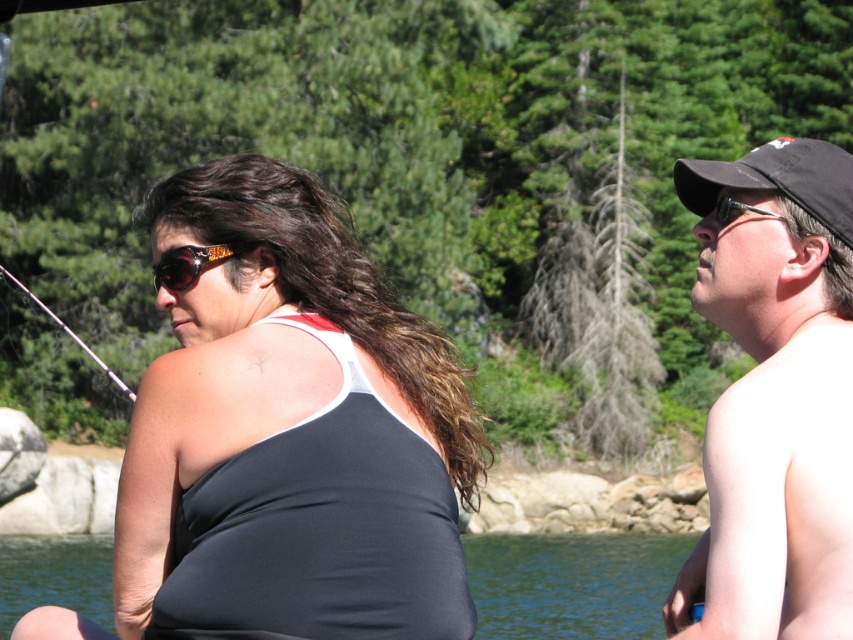
Question: Which point is closer to the camera taking this photo?

Choices:
 (A) (283, 202)
 (B) (844, 216)
 (C) (538, 589)

Answer: (B)

Question: Can you confirm if transparent water at lower center is positioned to the right of black fabric baseball cap at right?

Choices:
 (A) yes
 (B) no

Answer: (B)

Question: Which object is positioned farthest from the transparent water at lower center?

Choices:
 (A) black fabric baseball cap at right
 (B) black cap at right
 (C) black matte tank top at left

Answer: (A)

Question: Which point is closer to the camera taking this photo?

Choices:
 (A) (850, 236)
 (B) (251, 260)

Answer: (A)

Question: Can you confirm if transparent water at lower center is thinner than black fabric baseball cap at right?

Choices:
 (A) no
 (B) yes

Answer: (A)

Question: Can you confirm if black cap at right is thinner than black fabric baseball cap at right?

Choices:
 (A) yes
 (B) no

Answer: (B)